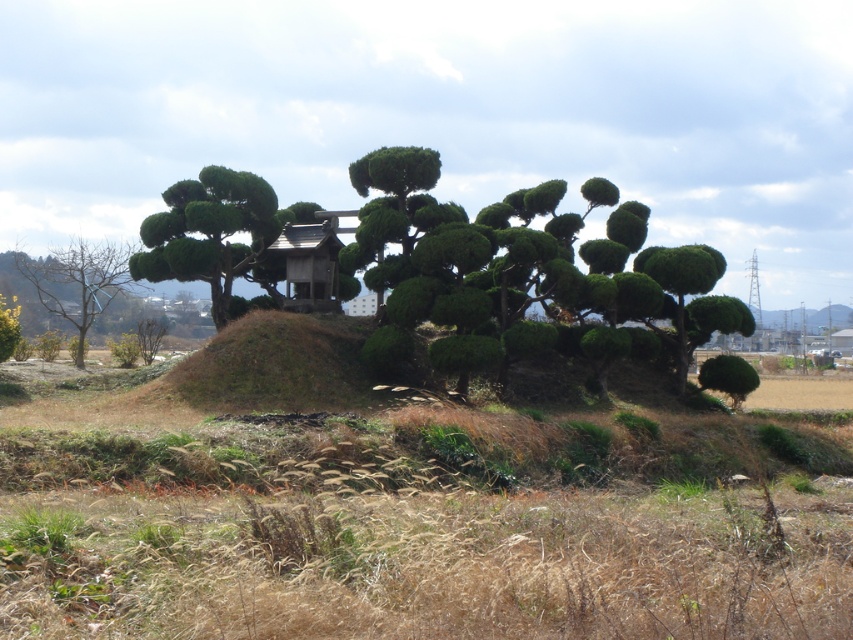
Question: Which point is closer to the camera?

Choices:
 (A) (160, 259)
 (B) (741, 376)

Answer: (B)

Question: Is bare wood tree at left positioned at the back of wooden hut at center?

Choices:
 (A) no
 (B) yes

Answer: (B)

Question: Which point is closer to the camera taking this photo?

Choices:
 (A) (622, 259)
 (B) (238, 225)
 (C) (711, 364)
 (D) (257, 266)

Answer: (C)

Question: Based on their relative distances, which object is farther from the green leafy bush at right?

Choices:
 (A) bare wood tree at left
 (B) green leafy bush at center
 (C) wooden hut at center
 (D) green textured bush at left

Answer: (A)

Question: From the image, what is the correct spatial relationship of bare wood tree at left in relation to green leafy bush at right?

Choices:
 (A) above
 (B) below

Answer: (A)

Question: Is the position of bare wood tree at left less distant than that of green leafy bush at right?

Choices:
 (A) no
 (B) yes

Answer: (A)